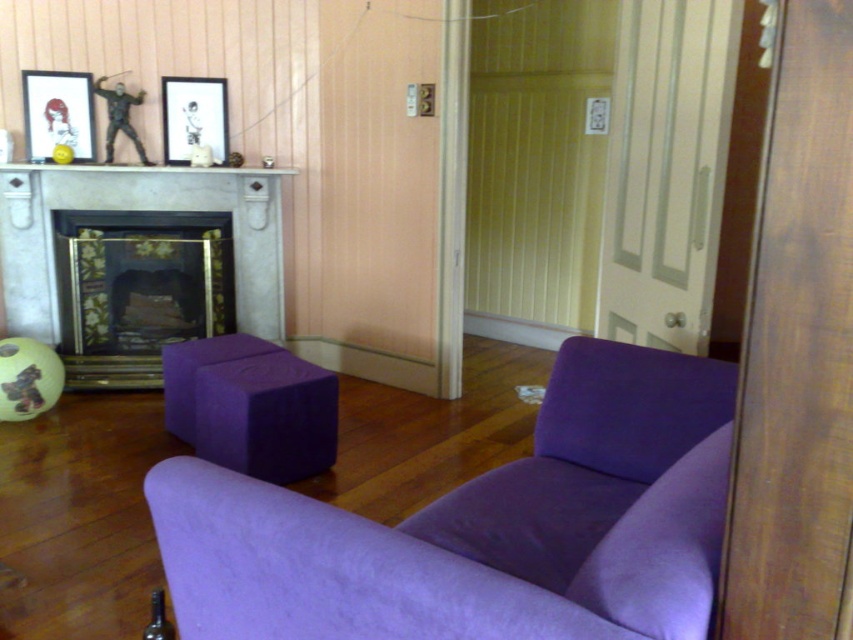
You are standing in the living room and want to hang a new painting. The current matte black picture frame at upper center is in the way. Can you move the matte gray fireplace at left to make space?

The matte gray fireplace at left is closer to the viewer than the matte black picture frame at upper center, so you cannot move the fireplace to make space because fireplaces are typically fixed structures and cannot be moved easily.

You are an interior designer planning to hang a new painting in the living room. The existing matte black picture frame at upper left is already placed at coordinates point 0.178, 0.069. If you want to place the new painting 0.1 units to the right and 0.05 units down from the existing frame, what would be the new coordinates?

The new coordinates would be calculated by adding 0.1 to the x coordinate and 0.05 to the y coordinate of the existing matte black picture frame at upper left. The new coordinates would be approximately (101, 177).